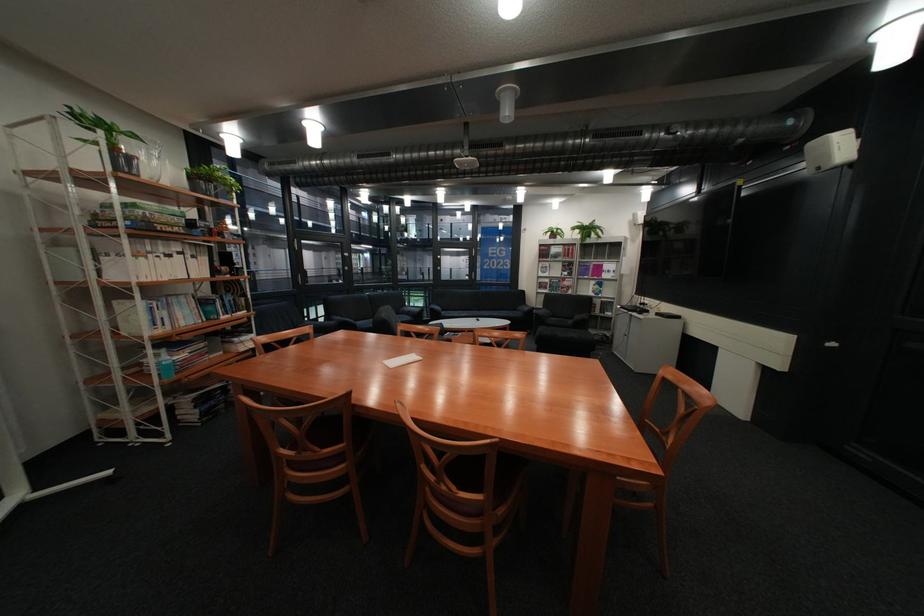
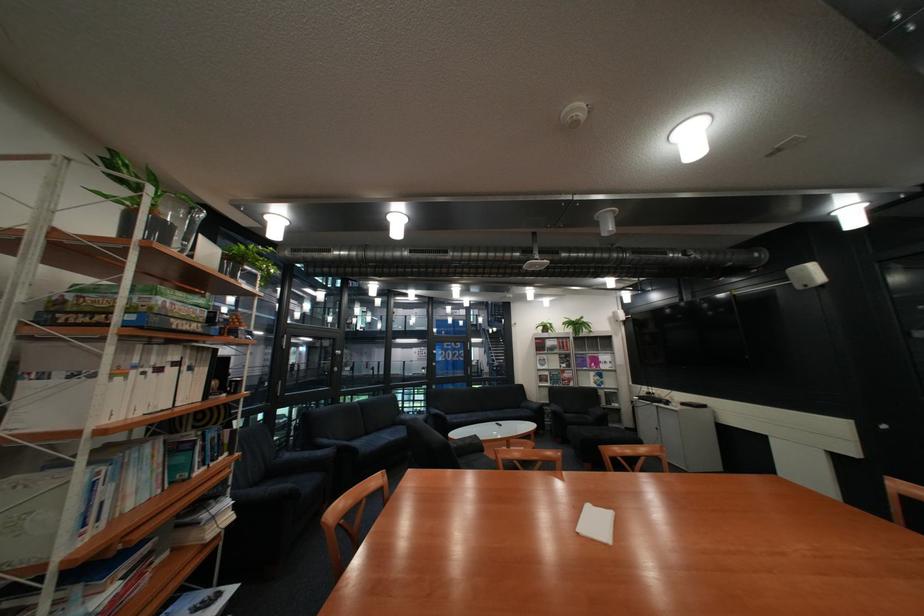
Where in the second image is the point corresponding to the point at 157,259 from the first image?

(134, 379)